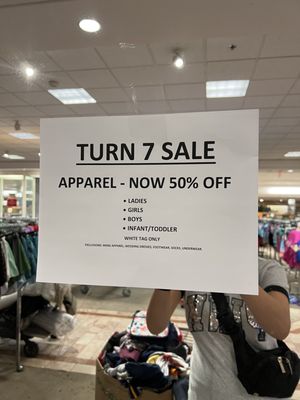
What are the coordinates of `clothes rack` in the screenshot? It's located at (13, 225), (18, 304), (278, 221).